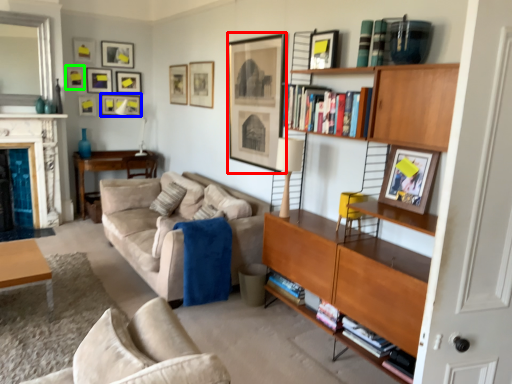
Question: Which object is positioned farthest from picture frame (highlighted by a red box)? Select from picture frame (highlighted by a blue box) and picture frame (highlighted by a green box).

Choices:
 (A) picture frame
 (B) picture frame

Answer: (B)